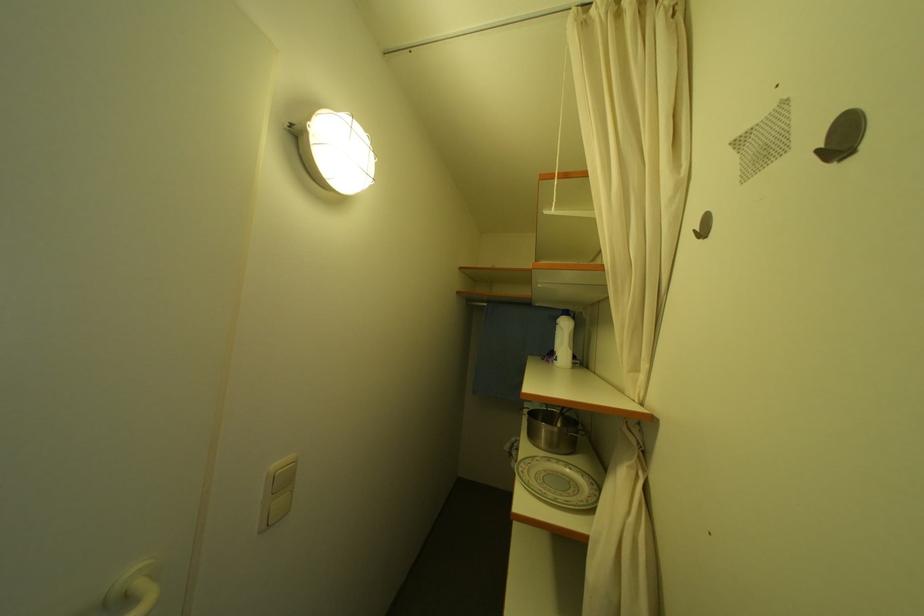
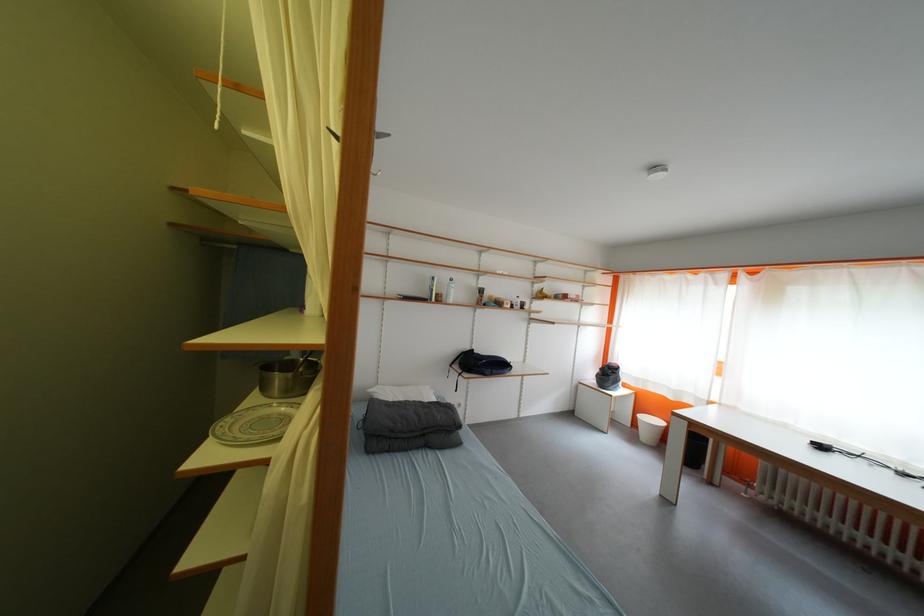
Where in the second image is the point corresponding to (530,468) from the first image?

(237, 422)